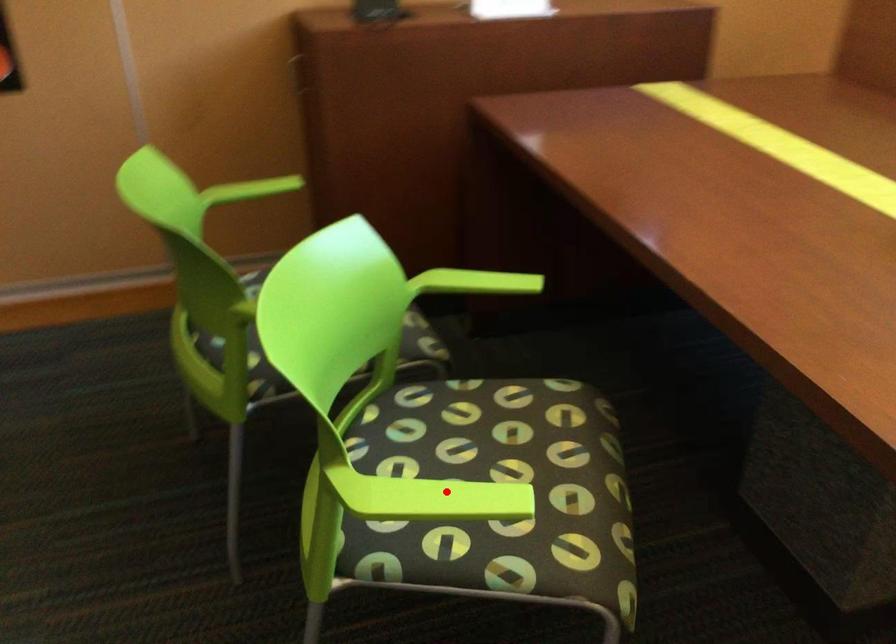
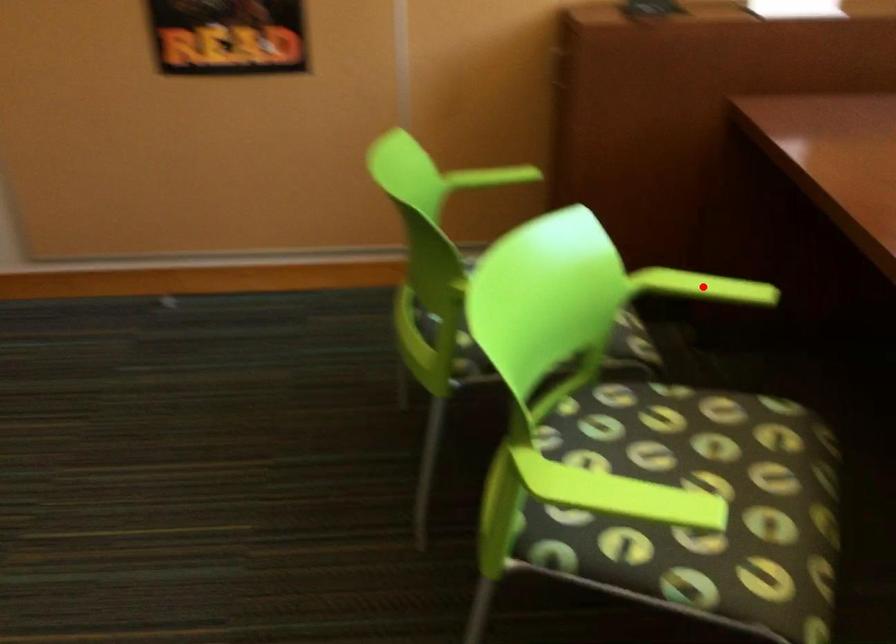
I am providing you with two images of the same scene from different viewpoints. A red point is marked on the first image and another point is marked on the second image. Is the marked point in image1 the same physical position as the marked point in image2?

No